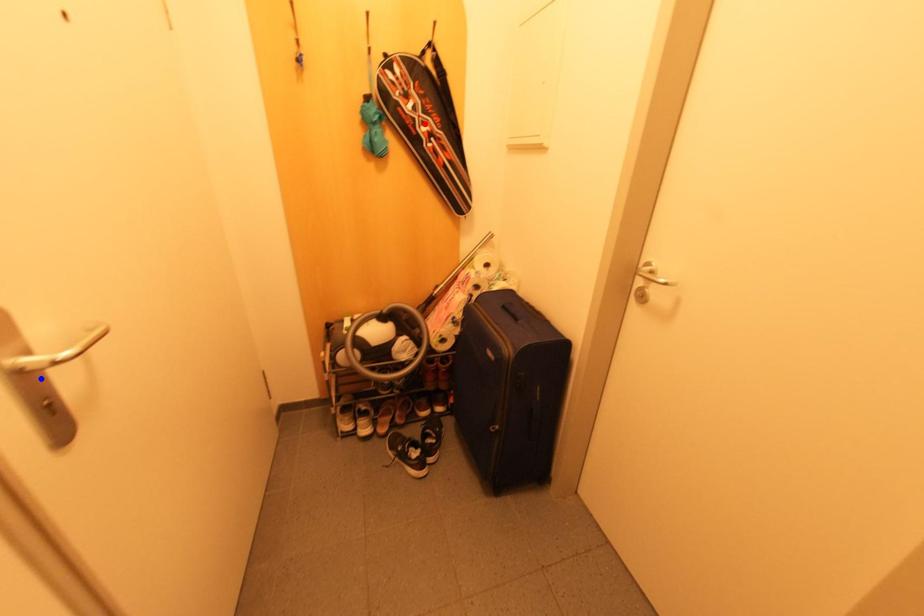
Question: Which of the two points in the image is closer to the camera?

Choices:
 (A) Blue point is closer.
 (B) Red point is closer.

Answer: (A)